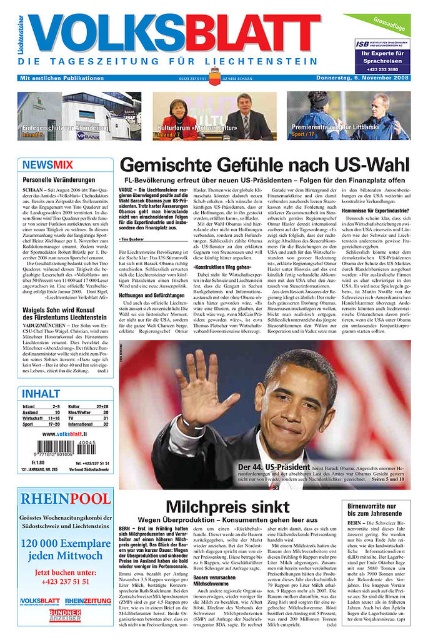
Measure the distance from dark gray suit at center to matte black suit at center.

dark gray suit at center is 19.46 inches away from matte black suit at center.

Who is shorter, dark gray suit at center or matte black suit at center?

Standing shorter between the two is matte black suit at center.

Between point (261, 404) and point (240, 116), which one is positioned in front?

Point (240, 116)

Where is `dark gray suit at center`? dark gray suit at center is located at coordinates (249, 429).